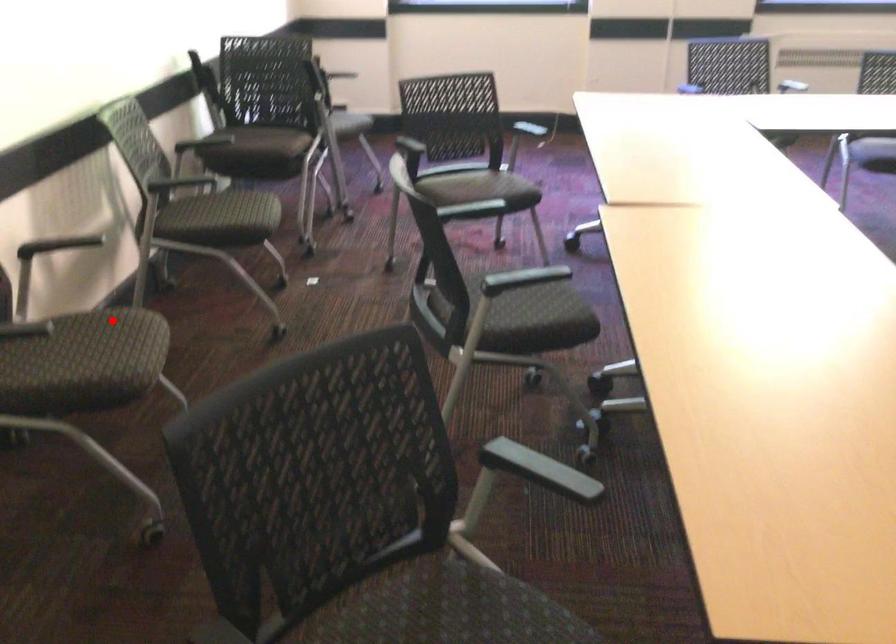
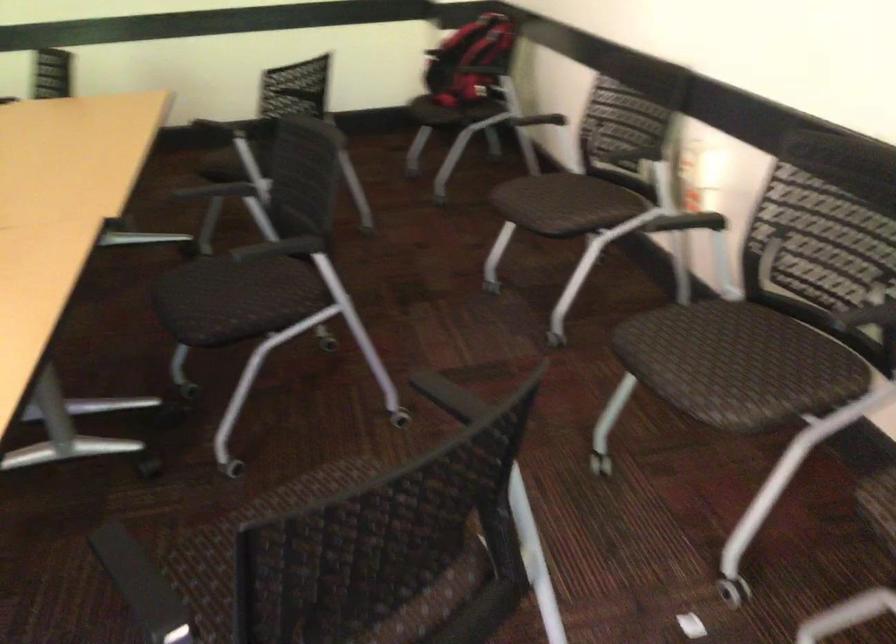
Question: I am providing you with two images of the same scene from different viewpoints. In image1, a red point is highlighted. Considering the same 3D point in image2, which of the following is correct?

Choices:
 (A) It is closer
 (B) It is farther

Answer: (B)